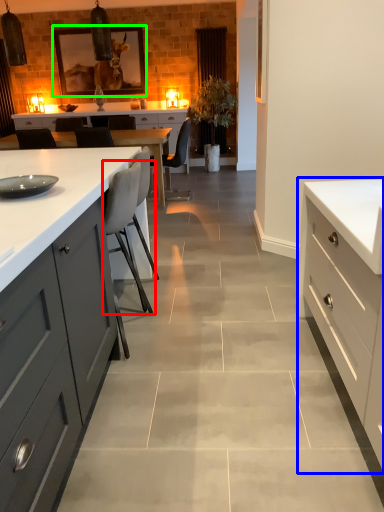
Question: Based on their relative distances, which object is farther from chair (highlighted by a red box)? Choose from cabinetry (highlighted by a blue box) and picture frame (highlighted by a green box).

Choices:
 (A) cabinetry
 (B) picture frame

Answer: (B)